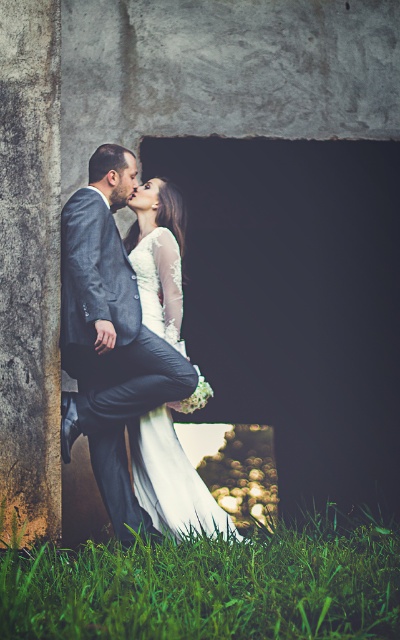
You are standing at the point marked as point (208, 588) in the image. What can you see directly below you?

At point (208, 588) lies green grass at lower center.

You are a photographer at a wedding who wants to ensure both the matte gray suit at center and the white satin dress at center are clearly visible in the photo. Given their sizes, which one might you need to adjust your camera focus on more carefully to ensure it isn

The matte gray suit at center is smaller than the white satin dress at center, so you might need to adjust your camera focus more carefully on the matte gray suit at center to ensure it is clearly visible.

You are standing at the same position as the photographer who took this photo. You want to place a small decoration between the two points, point(x=138, y=547) and point(x=206, y=497). Which point should the decoration be closer to in order to be in the foreground?

The decoration should be closer to point(x=138, y=547) because it is in front of point(x=206, y=497).